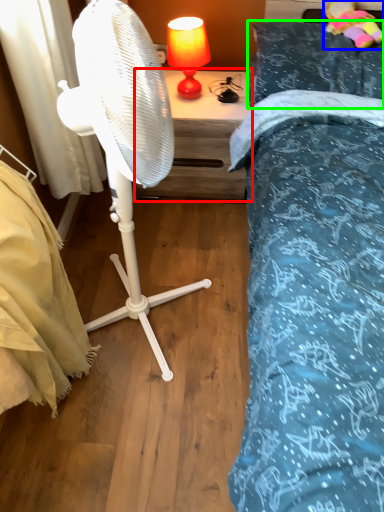
Question: Based on their relative distances, which object is farther from nightstand (highlighted by a red box)? Choose from toy (highlighted by a blue box) and pillow (highlighted by a green box).

Choices:
 (A) toy
 (B) pillow

Answer: (A)